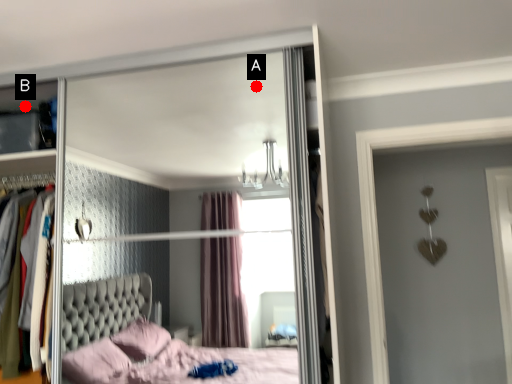
Question: Two points are circled on the image, labeled by A and B beside each circle. Among these points, which one is farthest from the camera?

Choices:
 (A) A is further
 (B) B is further

Answer: (B)